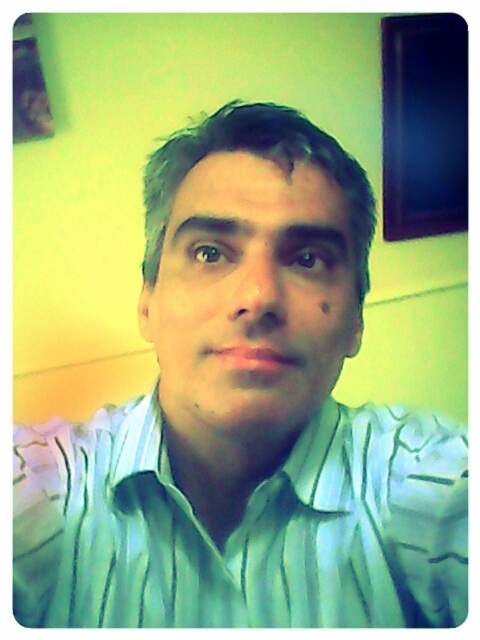
Based on the photo, can you confirm if green striped dress shirt at center is bigger than matte green shirt at center?

Correct, green striped dress shirt at center is larger in size than matte green shirt at center.

Between point (104, 483) and point (288, 365), which one is positioned in front?

Positioned in front is point (288, 365).

Locate an element on the screen. green striped dress shirt at center is located at coordinates (242, 528).